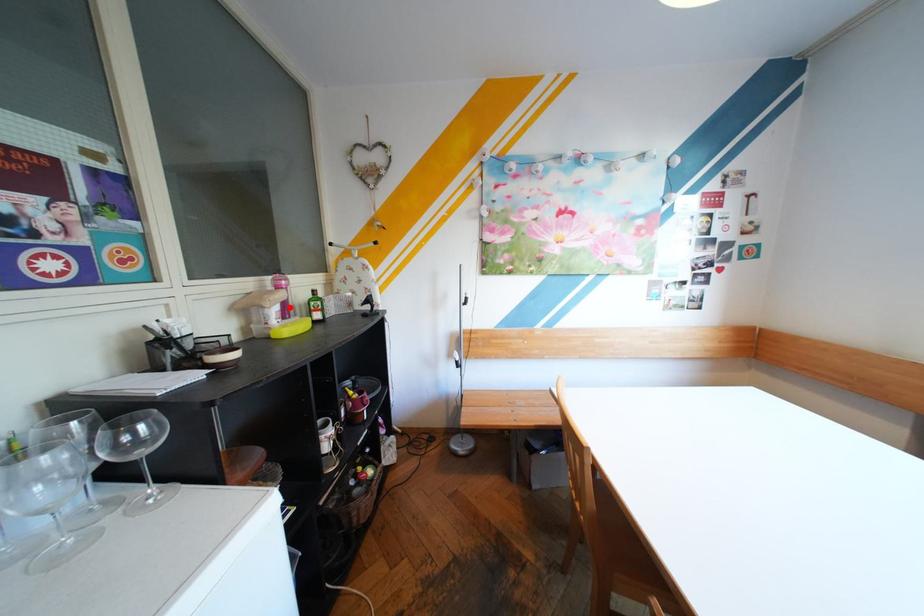
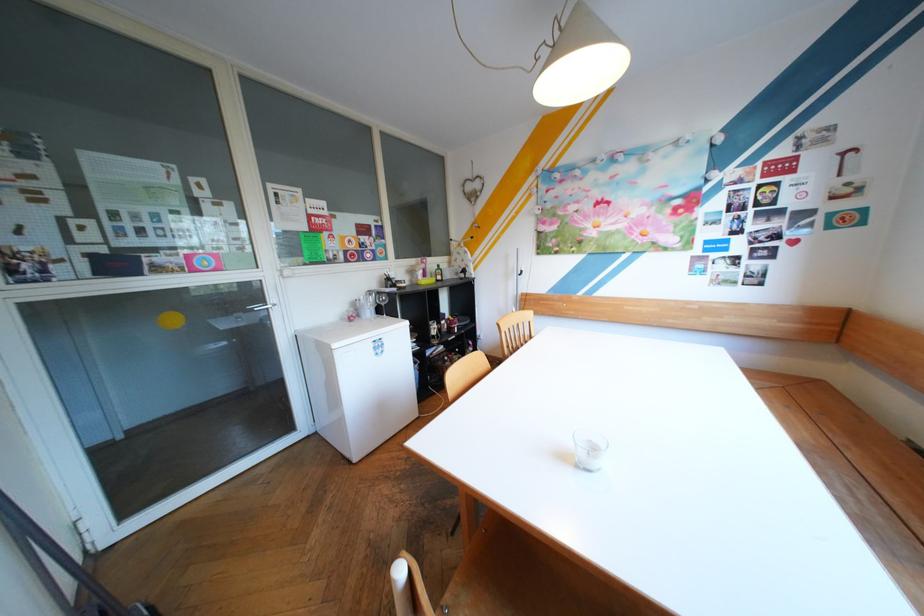
The point at the highlighted location is marked in the first image. Where is the corresponding point in the second image?

(434, 270)